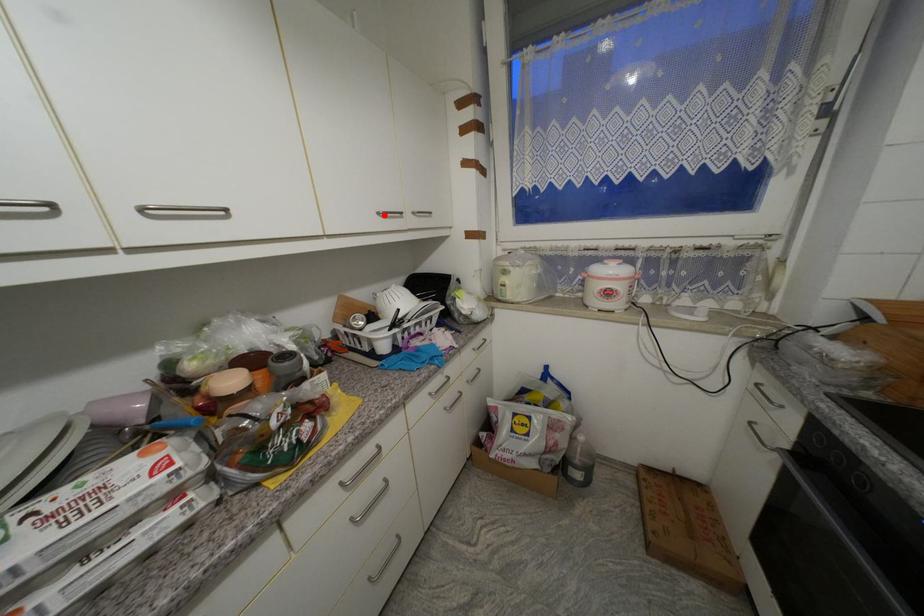
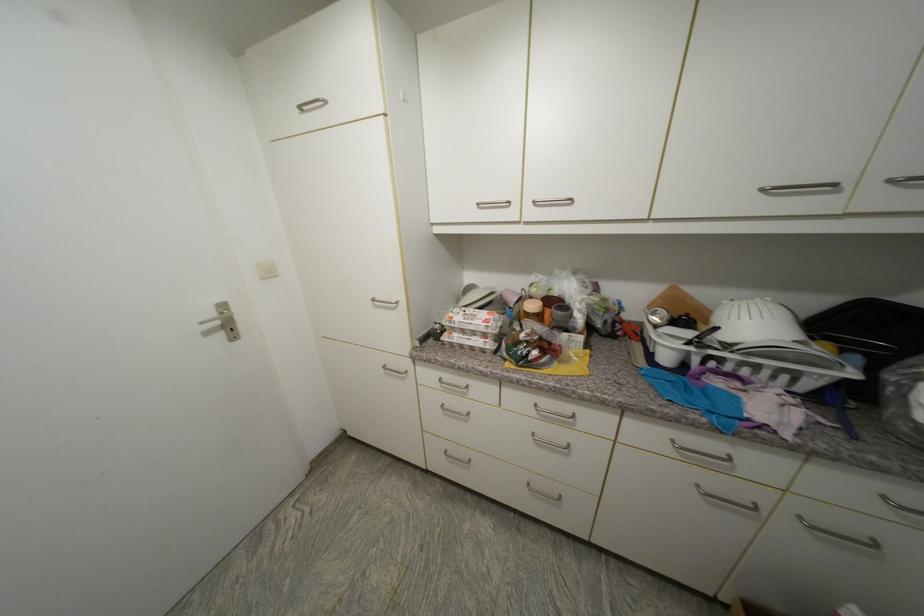
Where in the second image is the point corresponding to the highlighted location from the first image?

(768, 191)